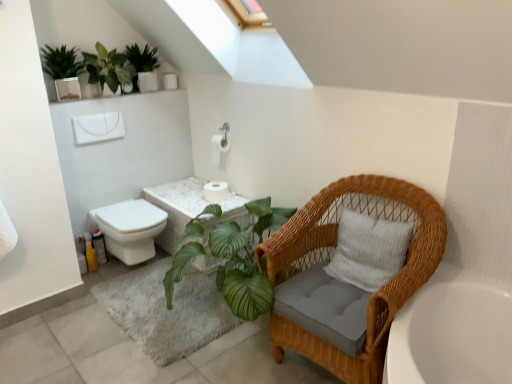
Question: From a real-world perspective, relative to green matte plant at upper left, which ranks as the 1th houseplant in left-to-right order, is white matte toilet paper at center, the 1th toilet paper positioned from the top, vertically above or below?

Choices:
 (A) above
 (B) below

Answer: (B)

Question: In the image, is white matte toilet paper at center, the 1th toilet paper positioned from the top, positioned in front of or behind green matte plant at upper left, which ranks as the 3th houseplant in right-to-left order?

Choices:
 (A) behind
 (B) front

Answer: (A)

Question: Considering the real-world distances, which object is farthest from the green leafy plant at upper left, marked as the 2th houseplant in a right-to-left arrangement?

Choices:
 (A) white matte toilet paper at center, arranged as the 1th toilet paper when ordered from the bottom
 (B) white glossy toilet at lower left
 (C) white matte toilet paper at center, the 1th toilet paper positioned from the top
 (D) white wicker vanity at center
 (E) woven wicker chair at right

Answer: (E)

Question: Estimate the real-world distances between objects in this image. Which object is closer to the white wicker vanity at center?

Choices:
 (A) woven wicker chair at right
 (B) white glossy toilet at lower left
 (C) green leafy plant at upper left, placed as the second houseplant when sorted from left to right
 (D) green matte plant at upper left, which ranks as the 3th houseplant in right-to-left order
 (E) white matte toilet paper at center, placed as the second toilet paper when sorted from top to bottom

Answer: (E)